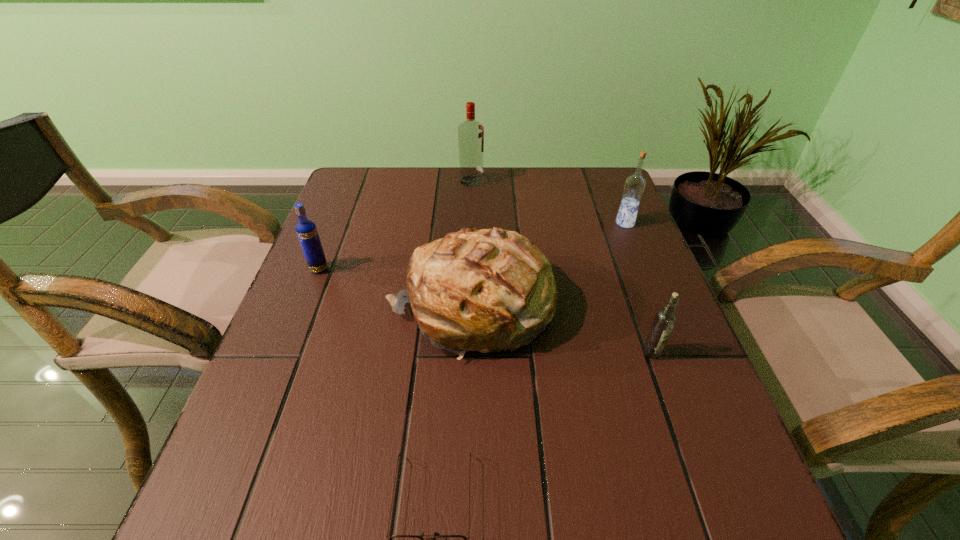
This screenshot has width=960, height=540. Identify the location of the farthest vodka. (470, 133).

Image resolution: width=960 pixels, height=540 pixels. Identify the location of the farthest object. (470, 133).

The width and height of the screenshot is (960, 540). I want to click on the second farthest vodka, so click(635, 184).

This screenshot has width=960, height=540. In order to click on the rightmost vodka in this screenshot , I will do `click(635, 184)`.

What are the coordinates of `bread` in the screenshot? It's located at (486, 290).

This screenshot has height=540, width=960. Find the location of `the leftmost vodka`. the leftmost vodka is located at coordinates (306, 230).

You are a GUI agent. You are given a task and a screenshot of the screen. Output one action in this format:
    pyautogui.click(x=<x>, y=<y>)
    Task: Click on the leftmost object
    This screenshot has width=960, height=540.
    Given the screenshot: What is the action you would take?
    pyautogui.click(x=306, y=230)

Identify the location of the nearest vodka. The width and height of the screenshot is (960, 540). (664, 321).

The image size is (960, 540). I want to click on the second object from right to left, so click(x=664, y=321).

The image size is (960, 540). I want to click on vacant space situated on the front label of the second vodka from left to right, so click(x=618, y=181).